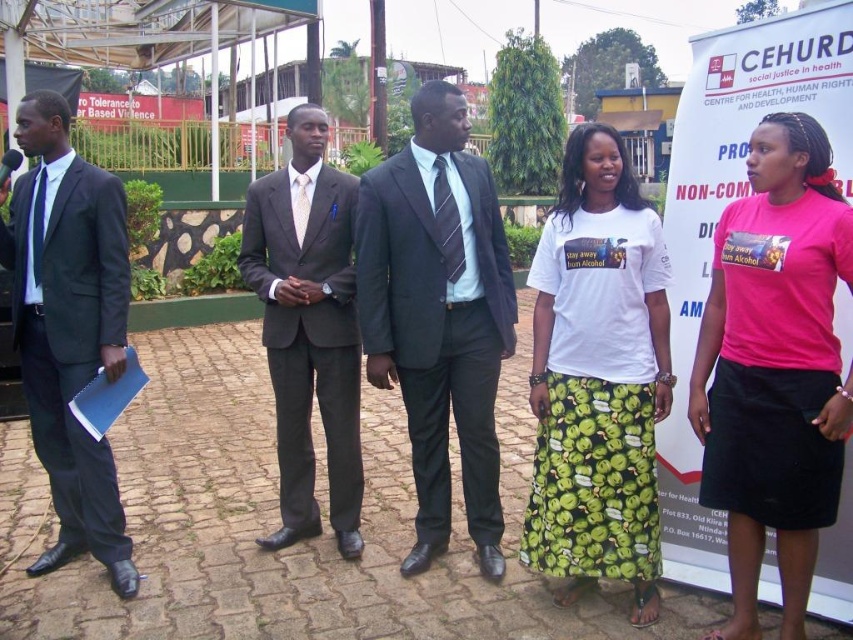
You are a photographer standing behind the group of people in the scene. You need to take a photo that includes both the matte gray suit at center and the blue matte folder at left. Which object will appear larger in the photo?

The matte gray suit at center will appear larger in the photo because it is closer to the photographer than the blue matte folder at left.

You are a photographer trying to capture a photo of the matte gray suit at center and the pink fabric skirt at lower right. Which one should you focus on first to ensure both are in sharp focus?

The pink fabric skirt at lower right is closer to the viewer than the matte gray suit at center, so you should focus on the pink fabric skirt at lower right first. This ensures that both will be in focus due to the depth of field.

You are a photographer trying to capture a group photo of the matte gray suit at center and the blue matte folder at left. Since you want to ensure both subjects are clearly visible, which object should you focus on first considering their sizes?

The matte gray suit at center is wider than the blue matte folder at left, so you should focus on the matte gray suit at center first to ensure its details are captured clearly before adjusting for the smaller folder.